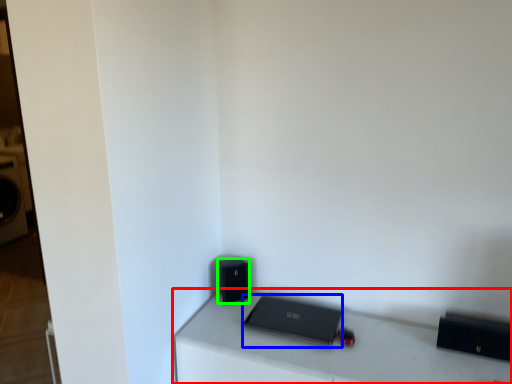
Question: Which is farther away from furniture (highlighted by a red box)? laptop (highlighted by a blue box) or speaker (highlighted by a green box)?

Choices:
 (A) laptop
 (B) speaker

Answer: (B)